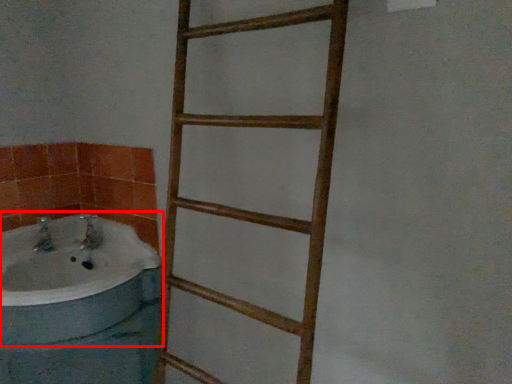
Question: From the image's perspective, what is the correct spatial positioning of bathtub (annotated by the red box) in reference to ladder?

Choices:
 (A) above
 (B) below

Answer: (B)